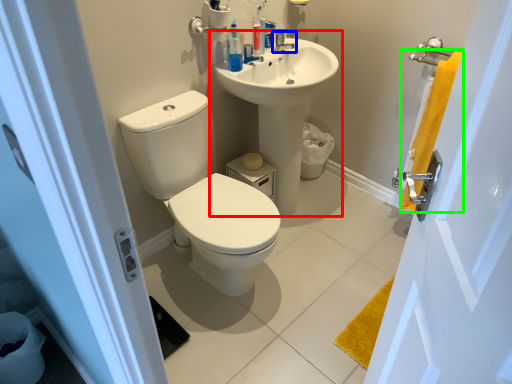
Question: Estimate the real-world distances between objects in this image. Which object is closer to sink (highlighted by a red box), tap (highlighted by a blue box) or bath towel (highlighted by a green box)?

Choices:
 (A) tap
 (B) bath towel

Answer: (A)